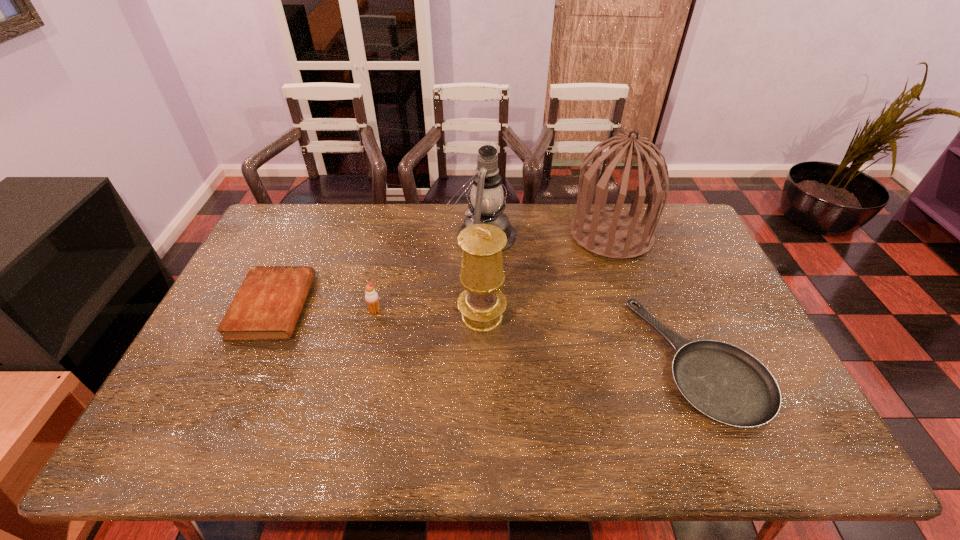
Where is `vacant area that lies between the third shortest object and the frying pan`? The height and width of the screenshot is (540, 960). vacant area that lies between the third shortest object and the frying pan is located at coordinates tap(537, 335).

The width and height of the screenshot is (960, 540). Identify the location of free space between the frying pan and the farther oil lamp. (590, 298).

Identify the location of free point between the third shortest object and the farther oil lamp. Image resolution: width=960 pixels, height=540 pixels. (428, 273).

Locate an element on the screen. vacant area between the second shortest object and the farther oil lamp is located at coordinates (377, 271).

Image resolution: width=960 pixels, height=540 pixels. What are the coordinates of `free space between the birdcage and the farther oil lamp` in the screenshot? It's located at (546, 234).

Locate an element on the screen. the fifth closest object to the leftmost object is located at coordinates (725, 383).

Point out which object is positioned as the fifth nearest to the fifth tallest object. Please provide its 2D coordinates. Your answer should be formatted as a tuple, i.e. [(x, y)], where the tuple contains the x and y coordinates of a point satisfying the conditions above.

[(725, 383)]

You are a GUI agent. You are given a task and a screenshot of the screen. Output one action in this format:
    pyautogui.click(x=<x>, y=<y>)
    Task: Click on the free space that satisfies the following two spatial constraints: 1. on the spine side of the leftmost object; 2. on the back side of the frying pan
    The image size is (960, 540).
    Given the screenshot: What is the action you would take?
    pyautogui.click(x=249, y=360)

At what (x,y) coordinates should I click in order to perform the action: click on free point that satisfies the following two spatial constraints: 1. on the spine side of the nearer oil lamp; 2. on the left side of the fifth tallest object. Please return your answer as a coordinate pair (x, y). The width and height of the screenshot is (960, 540). Looking at the image, I should click on (x=268, y=316).

Find the location of a particular element. vacant space that satisfies the following two spatial constraints: 1. at the front with a straw on the shortest object; 2. on the left side of the fifth object from right to left is located at coordinates (364, 360).